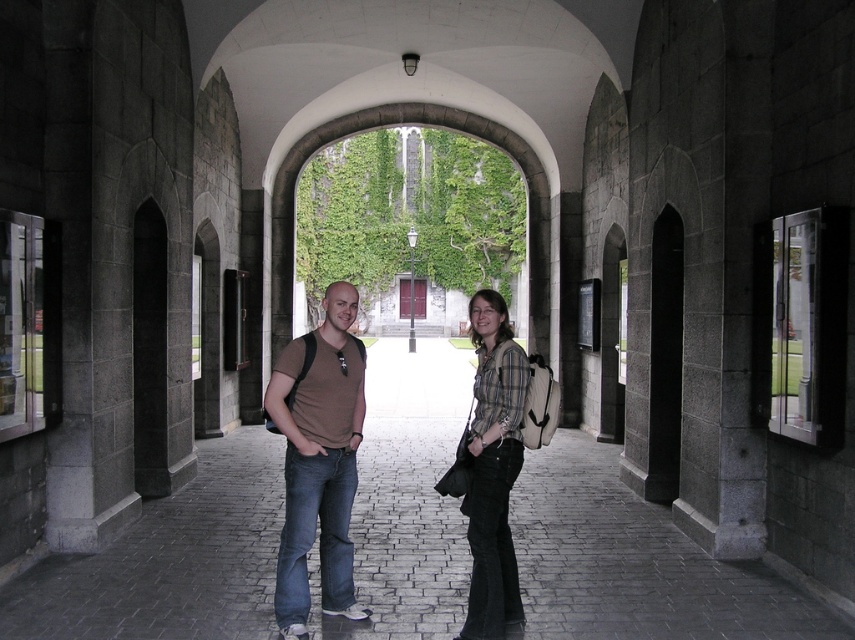
Question: Based on their relative distances, which object is farther from the brown cotton shirt at center?

Choices:
 (A) matte brown t-shirt at center
 (B) plaid shirt at center

Answer: (B)

Question: Can you confirm if brown cotton shirt at center is thinner than plaid shirt at center?

Choices:
 (A) no
 (B) yes

Answer: (A)

Question: Which object is closer to the camera taking this photo?

Choices:
 (A) brown cotton shirt at center
 (B) matte brown t-shirt at center
 (C) plaid shirt at center

Answer: (C)

Question: Does brown cotton shirt at center appear under matte brown t-shirt at center?

Choices:
 (A) no
 (B) yes

Answer: (A)

Question: Does brown cotton shirt at center appear on the left side of matte brown t-shirt at center?

Choices:
 (A) no
 (B) yes

Answer: (A)

Question: Which of the following is the closest to the observer?

Choices:
 (A) (342, 474)
 (B) (333, 484)

Answer: (B)